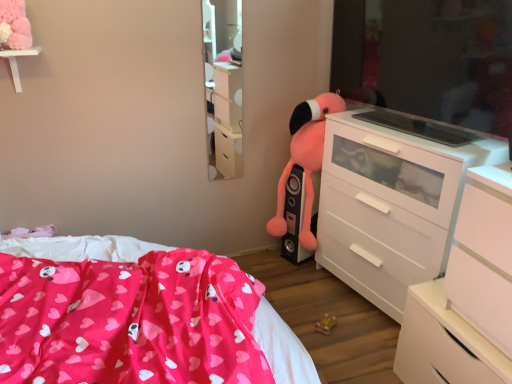
Question: Is white matte chest of drawers at right, the 3th chest of drawers in the back-to-front sequence, taller or shorter than fluffy pink stuffed animal at center-right?

Choices:
 (A) tall
 (B) short

Answer: (B)

Question: From the image's perspective, is white matte chest of drawers at right, the first chest of drawers viewed from the front, positioned above or below fluffy pink stuffed animal at center-right?

Choices:
 (A) above
 (B) below

Answer: (B)

Question: Which of these objects is positioned closest to the white matte chest of drawers at right, the 3th chest of drawers in the back-to-front sequence?

Choices:
 (A) fluffy pink stuffed animal at center-right
 (B) white glossy chest of drawers at lower right, acting as the 2th chest of drawers starting from the front
 (C) light wood mirror at upper center
 (D) pink fabric bed at lower left
 (E) white glossy chest of drawers at right, which is counted as the 3th chest of drawers, starting from the front

Answer: (B)

Question: Considering the real-world distances, which object is closest to the pink fabric bed at lower left?

Choices:
 (A) light wood mirror at upper center
 (B) white matte chest of drawers at right, the 3th chest of drawers in the back-to-front sequence
 (C) fluffy pink stuffed animal at center-right
 (D) white glossy chest of drawers at lower right, which is the 2th chest of drawers from back to front
 (E) white glossy chest of drawers at right, the 1th chest of drawers when ordered from back to front

Answer: (C)